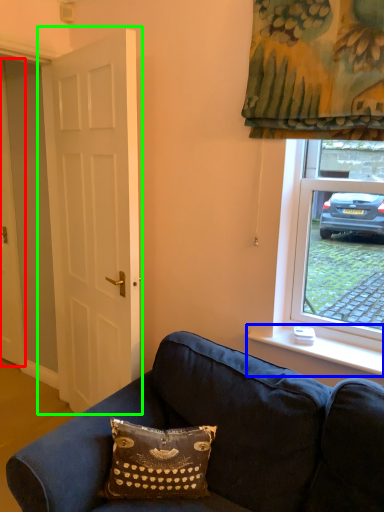
Question: Based on their relative distances, which object is nearer to door (highlighted by a red box)? Choose from window sill (highlighted by a blue box) and door (highlighted by a green box).

Choices:
 (A) window sill
 (B) door

Answer: (B)